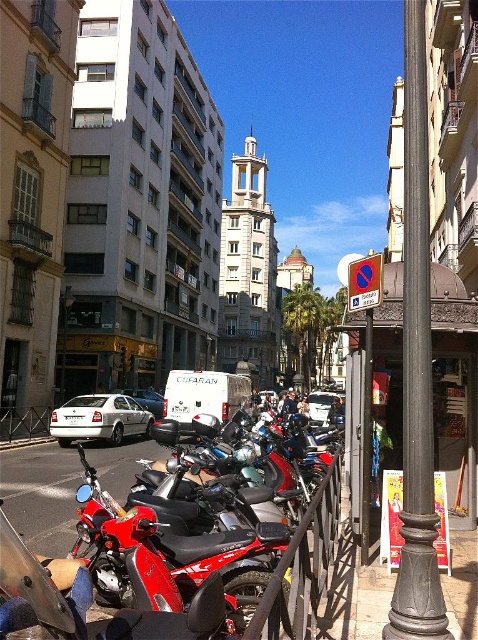
Question: Which object is positioned farthest from the white matte sedan at center?

Choices:
 (A) black metal fence at lower left
 (B) dark brown polished metal pole at right
 (C) brushed metal lamp post at center
 (D) shiny red motorcycle at center

Answer: (B)

Question: Which object appears closest to the camera in this image?

Choices:
 (A) shiny red motorcycle at center
 (B) black metal fence at lower left
 (C) brushed metal lamp post at center

Answer: (A)

Question: Does dark brown polished metal pole at right have a smaller size compared to black metal fence at lower left?

Choices:
 (A) no
 (B) yes

Answer: (A)

Question: Does white matte sedan at center appear on the right side of black metal fence at lower left?

Choices:
 (A) yes
 (B) no

Answer: (A)

Question: Does black metal fence at lower left appear on the right side of white matte van at center?

Choices:
 (A) yes
 (B) no

Answer: (B)

Question: Which object appears closest to the camera in this image?

Choices:
 (A) shiny red motorcycle at center
 (B) white matte car at center-left
 (C) white matte van at center
 (D) brushed metal lamp post at center

Answer: (A)